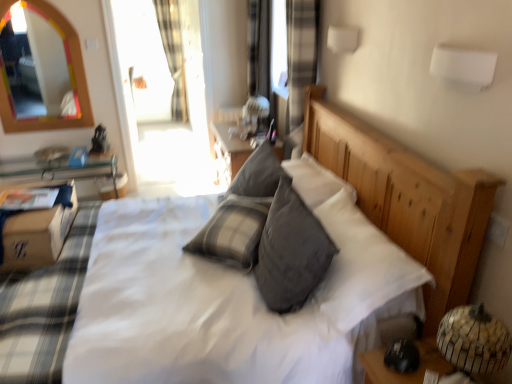
Question: Can you confirm if transparent glass door at upper center is positioned to the left of brown cardboard box at lower left?

Choices:
 (A) yes
 (B) no

Answer: (B)

Question: Would you say transparent glass door at upper center contains brown cardboard box at lower left?

Choices:
 (A) yes
 (B) no

Answer: (B)

Question: From the image's perspective, does transparent glass door at upper center appear lower than brown cardboard box at lower left?

Choices:
 (A) yes
 (B) no

Answer: (B)

Question: Is transparent glass door at upper center facing towards brown cardboard box at lower left?

Choices:
 (A) yes
 (B) no

Answer: (B)

Question: Does transparent glass door at upper center lie behind brown cardboard box at lower left?

Choices:
 (A) yes
 (B) no

Answer: (A)

Question: From a real-world perspective, is transparent glass door at upper center positioned over brown cardboard box at lower left based on gravity?

Choices:
 (A) no
 (B) yes

Answer: (B)

Question: Is plaid fabric curtain at upper left to the right of matte white table lamp at center from the viewer's perspective?

Choices:
 (A) yes
 (B) no

Answer: (B)

Question: From the image's perspective, is plaid fabric curtain at upper left beneath matte white table lamp at center?

Choices:
 (A) no
 (B) yes

Answer: (A)

Question: From a real-world perspective, is plaid fabric curtain at upper left over matte white table lamp at center?

Choices:
 (A) yes
 (B) no

Answer: (B)

Question: Can you see plaid fabric curtain at upper left touching matte white table lamp at center?

Choices:
 (A) yes
 (B) no

Answer: (B)

Question: Is plaid fabric curtain at upper left positioned with its back to matte white table lamp at center?

Choices:
 (A) yes
 (B) no

Answer: (B)

Question: Is plaid fabric curtain at upper left taller than matte white table lamp at center?

Choices:
 (A) yes
 (B) no

Answer: (A)

Question: Is plaid fabric curtain at upper left closer to the viewer compared to brown cardboard box at lower left?

Choices:
 (A) yes
 (B) no

Answer: (B)